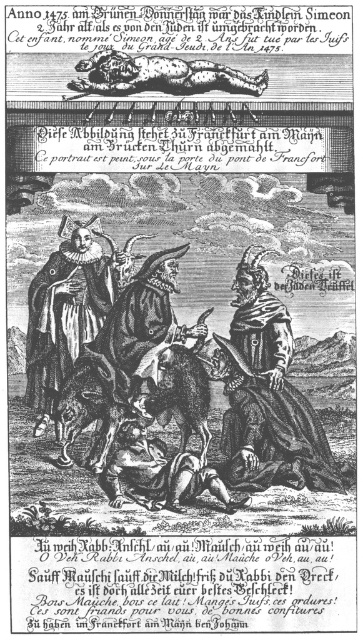
You are a historian examining this engraving and need to determine the spatial relationship between the wooden staff at center and the brown leather boots at lower center. How far apart are these two objects in meters?

The wooden staff at center is 7.83 meters away from the brown leather boots at lower center.

You are an art conservator examining this historical engraving. You need to determine if the distance between the matte black robe at center and the brown leather boots at lower center is sufficient to fit a 10 meter long protective barrier between them. Can you confirm if this is possible?

The matte black robe at center and brown leather boots at lower center are 11.57 meters apart, so yes, a 10 meter long protective barrier can fit between them since the distance is greater than the barrier length.

You are a historian analyzing the engraving. You need to determine if the distance between the brown leather boots at lower center and the brown leather dog at upper center is within a 40 meter range. Based on the engraving, what is your conclusion?

The brown leather boots at lower center is 37.50 meters from brown leather dog at upper center, so the distance between them is within the 40 meter range.